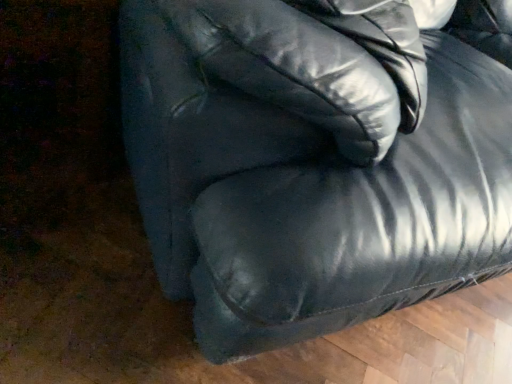
Describe the element at coordinates (317, 157) in the screenshot. I see `black leather couch at center` at that location.

Where is `black leather couch at center`? black leather couch at center is located at coordinates (317, 157).

Find the location of a particular element. Image resolution: width=512 pixels, height=384 pixels. black leather couch at center is located at coordinates (317, 157).